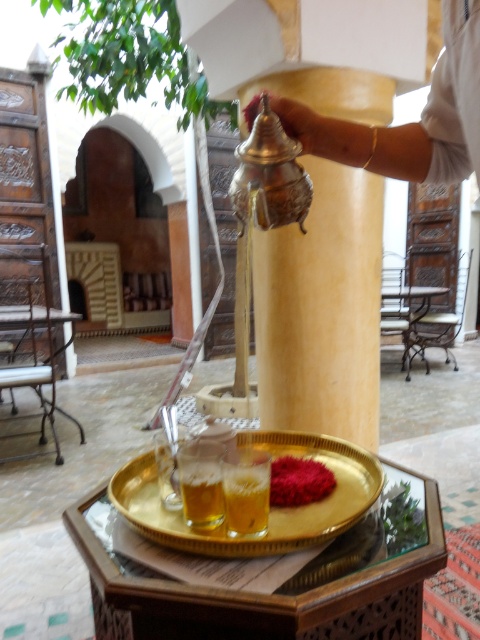
Is gold metallic tray at center to the left of translucent glass beverage at center from the viewer's perspective?

No, gold metallic tray at center is not to the left of translucent glass beverage at center.

Can you confirm if gold metallic tray at center is positioned to the right of translucent glass beverage at center?

Yes, gold metallic tray at center is to the right of translucent glass beverage at center.

Is point (311, 528) positioned behind point (267, 490)?

Yes, point (311, 528) is behind point (267, 490).

Where is `gold metallic tray at center`? The width and height of the screenshot is (480, 640). gold metallic tray at center is located at coordinates (269, 508).

Can you confirm if metallic gold pillar at center is positioned to the right of smooth red powder at center?

Indeed, metallic gold pillar at center is positioned on the right side of smooth red powder at center.

How much distance is there between metallic gold pillar at center and smooth red powder at center?

They are 1.10 meters apart.

Who is more forward, (289, 364) or (300, 458)?

Point (300, 458) is in front.

Locate an element on the screen. Image resolution: width=480 pixels, height=640 pixels. metallic gold pillar at center is located at coordinates (322, 308).

Consider the image. Between gold metallic tray at center and translucent glass at lower center, which one appears on the left side from the viewer's perspective?

Positioned to the left is translucent glass at lower center.

Which is in front, point (333, 529) or point (197, 481)?

Point (333, 529) is more forward.

This screenshot has width=480, height=640. Identify the location of gold metallic tray at center. (269, 508).